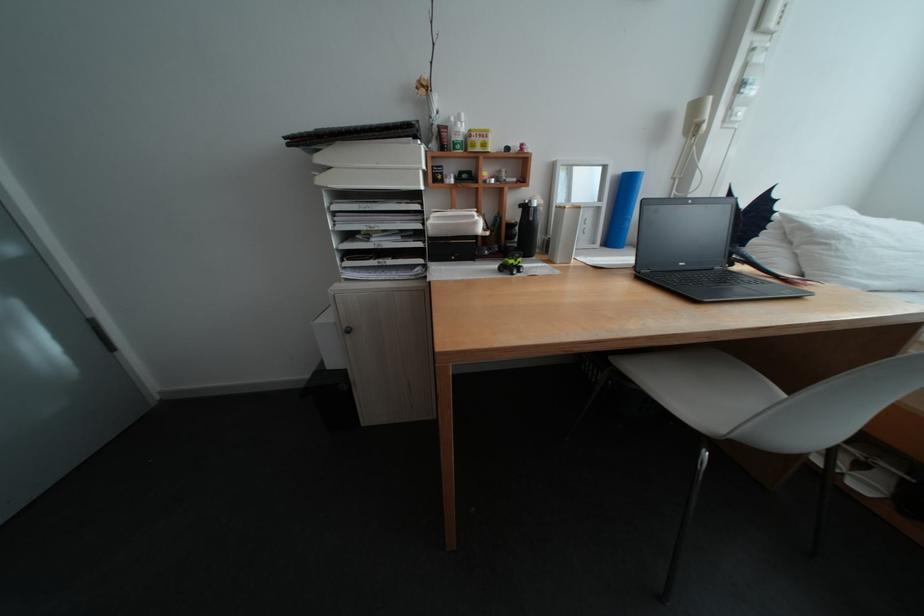
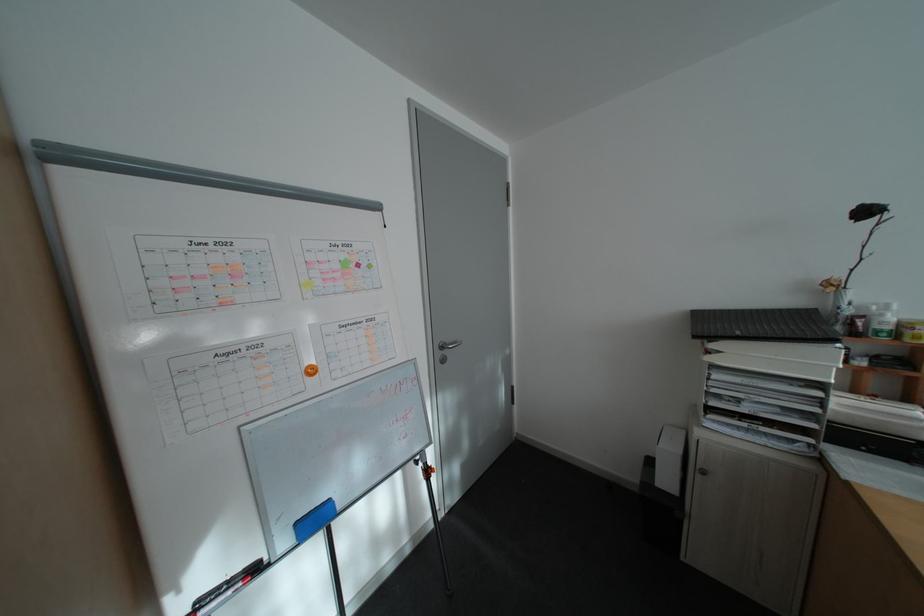
Question: Based on the continuous images, in which direction is the camera rotating? Reply with the corresponding letter.

Choices:
 (A) Left
 (B) Right
 (C) Up
 (D) Down

Answer: (A)